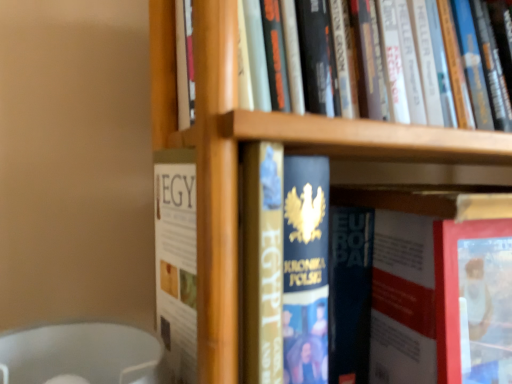
Identify the location of hardcover book at center, the third book from the bottom. (430, 202).

Identify the location of hardcover book at center, which is the 1th book in bottom-to-top order. (439, 286).

Measure the distance between point (399, 251) and camera.

The distance of point (399, 251) from camera is 49.60 centimeters.

Locate an element on the screen. hardcover books at upper center, which is counted as the first book, starting from the top is located at coordinates (185, 65).

Is hardcover book at center, which appears as the second book when viewed from the top, taller or shorter than hardcover book at center?

In the image, hardcover book at center, which appears as the second book when viewed from the top, appears to be taller than hardcover book at center.

Is point (254, 193) closer to camera compared to point (448, 245)?

Yes, it is in front of point (448, 245).

Can you confirm if hardcover book at center, the third book from the bottom, is thinner than hardcover book at center?

No, hardcover book at center, the third book from the bottom, is not thinner than hardcover book at center.

Is hardcover book at center, the third book from the bottom, at the right side of hardcover book at center?

No, hardcover book at center, the third book from the bottom, is not to the right of hardcover book at center.

From a real-world perspective, is hardcover book at center positioned under hardcover book at center, which is the 1th book in bottom-to-top order, based on gravity?

No, from a real-world perspective, hardcover book at center is not below hardcover book at center, which is the 1th book in bottom-to-top order.

How many degrees apart are the facing directions of hardcover book at center and hardcover book at center, which is the 1th book in bottom-to-top order?

The facing directions of hardcover book at center and hardcover book at center, which is the 1th book in bottom-to-top order, are 6.35 degrees apart.

Considering the relative positions of hardcover book at center and hardcover book at center, placed as the fourth book when sorted from top to bottom, in the image provided, is hardcover book at center to the left or to the right of hardcover book at center, placed as the fourth book when sorted from top to bottom,?

hardcover book at center is to the right of hardcover book at center, placed as the fourth book when sorted from top to bottom.

Looking at this image, does hardcover book at center lie in front of hardcover book at center, which is the 1th book in bottom-to-top order?

Yes, the depth of hardcover book at center is less than that of hardcover book at center, which is the 1th book in bottom-to-top order.

Can you confirm if hardcover book at center, placed as the fourth book when sorted from top to bottom, is positioned to the left of hardcover book at center, the third book from the bottom?

No.

The image size is (512, 384). What are the coordinates of `book that is the 2nd one when counting backward from the hardcover book at center, which appears as the second book when viewed from the top` in the screenshot? It's located at (439, 286).

Is hardcover book at center, placed as the fourth book when sorted from top to bottom, wider than hardcover book at center, which appears as the second book when viewed from the top?

In fact, hardcover book at center, placed as the fourth book when sorted from top to bottom, might be narrower than hardcover book at center, which appears as the second book when viewed from the top.

Does hardcover books at upper center, the fourth book from the bottom, lie behind gold foil book at center, acting as the third book starting from the top?

No, the depth of hardcover books at upper center, the fourth book from the bottom, is less than that of gold foil book at center, acting as the third book starting from the top.

Can you confirm if hardcover books at upper center, which is counted as the first book, starting from the top, is wider than gold foil book at center, which appears as the second book when ordered from the bottom?

Yes.

How many degrees apart are the facing directions of hardcover books at upper center, which is counted as the first book, starting from the top, and gold foil book at center, acting as the third book starting from the top?

hardcover books at upper center, which is counted as the first book, starting from the top, and gold foil book at center, acting as the third book starting from the top, are facing 3.88 degrees away from each other.

Is hardcover books at upper center, the fourth book from the bottom, outside of gold foil book at center, which appears as the second book when ordered from the bottom?

Yes, hardcover books at upper center, the fourth book from the bottom, is outside of gold foil book at center, which appears as the second book when ordered from the bottom.

In the image, is hardcover book at center positioned in front of or behind hardcover books at upper center, the fourth book from the bottom?

hardcover book at center is positioned farther from the viewer than hardcover books at upper center, the fourth book from the bottom.

From their relative heights in the image, would you say hardcover book at center is taller or shorter than hardcover books at upper center, which is counted as the first book, starting from the top?

In the image, hardcover book at center appears to be taller than hardcover books at upper center, which is counted as the first book, starting from the top.

Is hardcover book at center not near hardcover books at upper center, which is counted as the first book, starting from the top?

hardcover book at center is near hardcover books at upper center, which is counted as the first book, starting from the top, not far away.

Which is correct: hardcover book at center is inside gold foil book at center, acting as the third book starting from the top, or outside of it?

hardcover book at center lies outside gold foil book at center, acting as the third book starting from the top.

From a real-world perspective, which is physically above, hardcover book at center or gold foil book at center, which appears as the second book when ordered from the bottom?

From a 3D spatial view, gold foil book at center, which appears as the second book when ordered from the bottom, is above.

Is hardcover book at center taller than gold foil book at center, which appears as the second book when ordered from the bottom?

No.

Considering the relative positions of hardcover book at center and gold foil book at center, acting as the third book starting from the top, in the image provided, is hardcover book at center to the left of gold foil book at center, acting as the third book starting from the top, from the viewer's perspective?

Incorrect, hardcover book at center is not on the left side of gold foil book at center, acting as the third book starting from the top.

Is hardcover book at center, which appears as the second book when viewed from the top, aimed at hardcover book at center, placed as the fourth book when sorted from top to bottom?

No.

From the image's perspective, which one is positioned higher, hardcover book at center, the third book from the bottom, or hardcover book at center, which is the 1th book in bottom-to-top order?

From the image's view, hardcover book at center, the third book from the bottom, is above.

Is hardcover book at center, which appears as the second book when viewed from the top, far away from hardcover book at center, which is the 1th book in bottom-to-top order?

No, hardcover book at center, which appears as the second book when viewed from the top, is not far away from hardcover book at center, which is the 1th book in bottom-to-top order.

Does hardcover book at center, the third book from the bottom, have a greater height compared to hardcover book at center, which is the 1th book in bottom-to-top order?

Yes.

At what (x,y) coordinates should I click in order to perform the action: click on paperback book behind the hardcover book at center, which appears as the second book when viewed from the top. Please return your answer as a coordinate pair (x, y). Looking at the image, I should click on (473, 298).

At what (x,y) coordinates should I click in order to perform the action: click on paperback book above the hardcover book at center, placed as the fourth book when sorted from top to bottom (from a real-world perspective). Please return your answer as a coordinate pair (x, y). This screenshot has height=384, width=512. Looking at the image, I should click on (473, 298).

Estimate the real-world distances between objects in this image. Which object is further from gold foil book at center, acting as the third book starting from the top, hardcover book at center, which appears as the second book when viewed from the top, or hardcover book at center, placed as the fourth book when sorted from top to bottom?

Among the two, hardcover book at center, placed as the fourth book when sorted from top to bottom, is located further to gold foil book at center, acting as the third book starting from the top.

Estimate the real-world distances between objects in this image. Which object is closer to hardcover book at center, hardcover book at center, the third book from the bottom, or hardcover book at center, placed as the fourth book when sorted from top to bottom?

The object closer to hardcover book at center is hardcover book at center, placed as the fourth book when sorted from top to bottom.

Which object lies nearer to the anchor point hardcover book at center, the third book from the bottom, hardcover books at upper center, the fourth book from the bottom, or hardcover book at center?

hardcover books at upper center, the fourth book from the bottom, is closer to hardcover book at center, the third book from the bottom.

Considering their positions, is hardcover book at center positioned further to hardcover book at center, which appears as the second book when viewed from the top, than gold foil book at center, acting as the third book starting from the top?

hardcover book at center is positioned further to the anchor hardcover book at center, which appears as the second book when viewed from the top.

When comparing their distances from hardcover book at center, which appears as the second book when viewed from the top, does hardcover book at center, placed as the fourth book when sorted from top to bottom, or hardcover book at center seem closer?

Among the two, hardcover book at center, placed as the fourth book when sorted from top to bottom, is located nearer to hardcover book at center, which appears as the second book when viewed from the top.

Based on their spatial positions, is hardcover book at center or gold foil book at center, which appears as the second book when ordered from the bottom, closer to hardcover book at center, which is the 1th book in bottom-to-top order?

Based on the image, hardcover book at center appears to be nearer to hardcover book at center, which is the 1th book in bottom-to-top order.

Considering their positions, is hardcover books at upper center, the fourth book from the bottom, positioned further to hardcover book at center than hardcover book at center, placed as the fourth book when sorted from top to bottom?

The object further to hardcover book at center is hardcover books at upper center, the fourth book from the bottom.

Based on their spatial positions, is hardcover books at upper center, which is counted as the first book, starting from the top, or hardcover book at center, the third book from the bottom, further from gold foil book at center, which appears as the second book when ordered from the bottom?

hardcover books at upper center, which is counted as the first book, starting from the top, is positioned further to the anchor gold foil book at center, which appears as the second book when ordered from the bottom.

Identify the location of book that lies between hardcover books at upper center, which is counted as the first book, starting from the top, and gold foil book at center, acting as the third book starting from the top, from top to bottom. (430, 202).